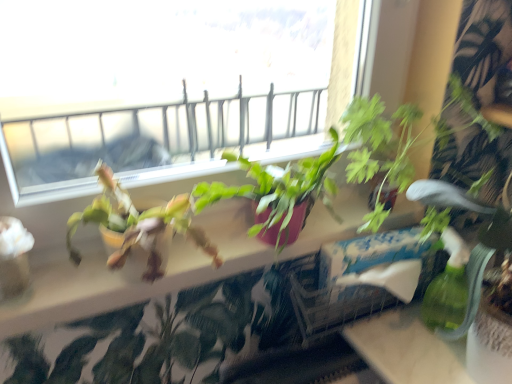
Question: Considering the relative sizes of matte pink pot at center and green leafy plant at right in the image provided, is matte pink pot at center smaller than green leafy plant at right?

Choices:
 (A) no
 (B) yes

Answer: (B)

Question: Does matte pink pot at center appear on the right side of green leafy plant at right?

Choices:
 (A) yes
 (B) no

Answer: (B)

Question: Considering the relative positions of matte pink pot at center and green leafy plant at right in the image provided, is matte pink pot at center in front of green leafy plant at right?

Choices:
 (A) no
 (B) yes

Answer: (A)

Question: Is matte pink pot at center placed right next to green leafy plant at right?

Choices:
 (A) yes
 (B) no

Answer: (B)

Question: Considering the relative sizes of matte pink pot at center and green leafy plant at right in the image provided, is matte pink pot at center wider than green leafy plant at right?

Choices:
 (A) no
 (B) yes

Answer: (A)

Question: From a real-world perspective, is green leafy plant at right above or below matte pink pot at center?

Choices:
 (A) below
 (B) above

Answer: (B)

Question: Is green leafy plant at right inside or outside of matte pink pot at center?

Choices:
 (A) inside
 (B) outside

Answer: (B)

Question: Does point (444, 201) appear closer or farther from the camera than point (51, 302)?

Choices:
 (A) farther
 (B) closer

Answer: (A)

Question: Relative to matte pink pot at center, is green leafy plant at right in front or behind?

Choices:
 (A) front
 (B) behind

Answer: (A)

Question: Is point (472, 271) positioned closer to the camera than point (316, 329)?

Choices:
 (A) farther
 (B) closer

Answer: (B)

Question: From a real-world perspective, relative to white cardboard box at center, is green leafy plant at right vertically above or below?

Choices:
 (A) below
 (B) above

Answer: (B)

Question: Considering the positions of green leafy plant at right and white cardboard box at center in the image, is green leafy plant at right taller or shorter than white cardboard box at center?

Choices:
 (A) tall
 (B) short

Answer: (A)

Question: Considering their positions, is green leafy plant at right located in front of or behind white cardboard box at center?

Choices:
 (A) behind
 (B) front

Answer: (B)

Question: In terms of width, does matte pink pot at center look wider or thinner when compared to white cardboard box at center?

Choices:
 (A) thin
 (B) wide

Answer: (A)

Question: Considering the positions of point (268, 259) and point (334, 264), is point (268, 259) closer or farther from the camera than point (334, 264)?

Choices:
 (A) farther
 (B) closer

Answer: (A)